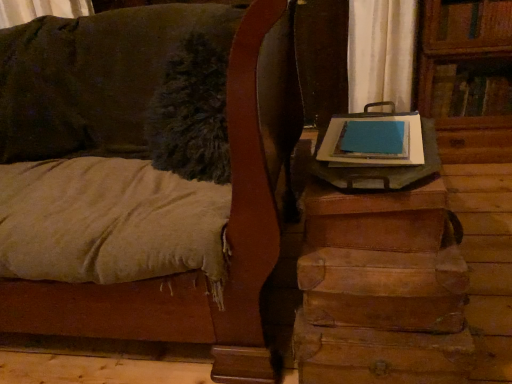
Question: Which is correct: brown leather suitcase at lower right is inside wooden trunk at right, or outside of it?

Choices:
 (A) outside
 (B) inside

Answer: (A)

Question: From the image's perspective, relative to wooden trunk at right, is brown leather suitcase at lower right above or below?

Choices:
 (A) above
 (B) below

Answer: (B)

Question: Visually, is brown leather suitcase at lower right positioned to the left or to the right of wooden trunk at right?

Choices:
 (A) right
 (B) left

Answer: (A)

Question: Considering the positions of wooden trunk at right and brown leather suitcase at lower right in the image, is wooden trunk at right wider or thinner than brown leather suitcase at lower right?

Choices:
 (A) wide
 (B) thin

Answer: (A)

Question: Choose the correct answer: Is wooden trunk at right inside brown leather suitcase at lower right or outside it?

Choices:
 (A) outside
 (B) inside

Answer: (A)

Question: From the image's perspective, relative to brown leather suitcase at lower right, is wooden trunk at right above or below?

Choices:
 (A) below
 (B) above

Answer: (B)

Question: Considering the relative positions of wooden trunk at right and brown leather suitcase at lower right in the image provided, is wooden trunk at right to the left or to the right of brown leather suitcase at lower right?

Choices:
 (A) right
 (B) left

Answer: (B)